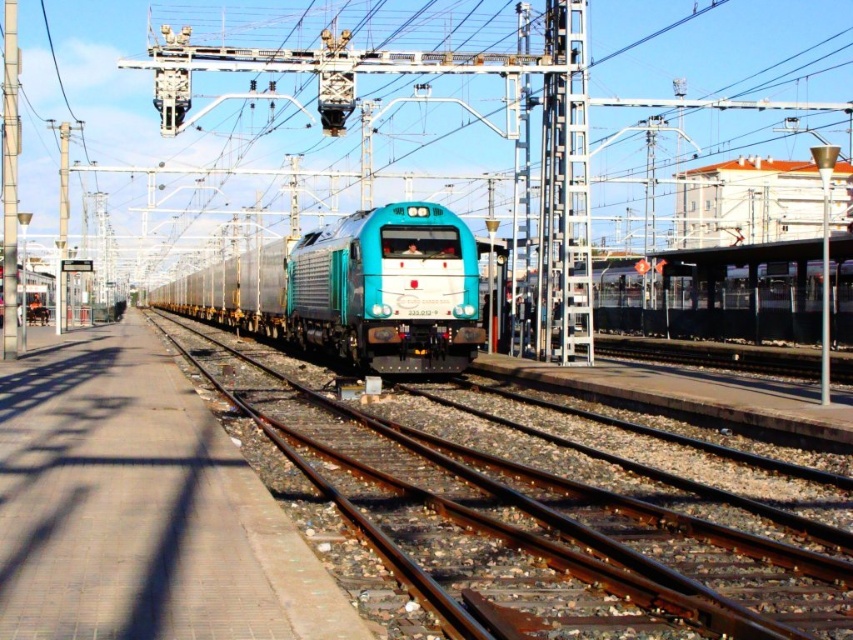
You are standing at the platform of the railway station and want to locate the brown metal train track at center. According to the coordinates provided, where exactly would you find it?

The brown metal train track at center is located at coordinates point (543, 525).

You are a maintenance worker needing to access the brown metal train track at center for repairs. There is a brushed metal pole at left above it. Can you safely stand on the track to work without touching the pole?

The brown metal train track at center is positioned under the brushed metal pole at left, so there is vertical clearance between them. However, the exact distance isn not provided. To determine safety, you must ensure the pole and wires are not too low to allow working safely on the track below.